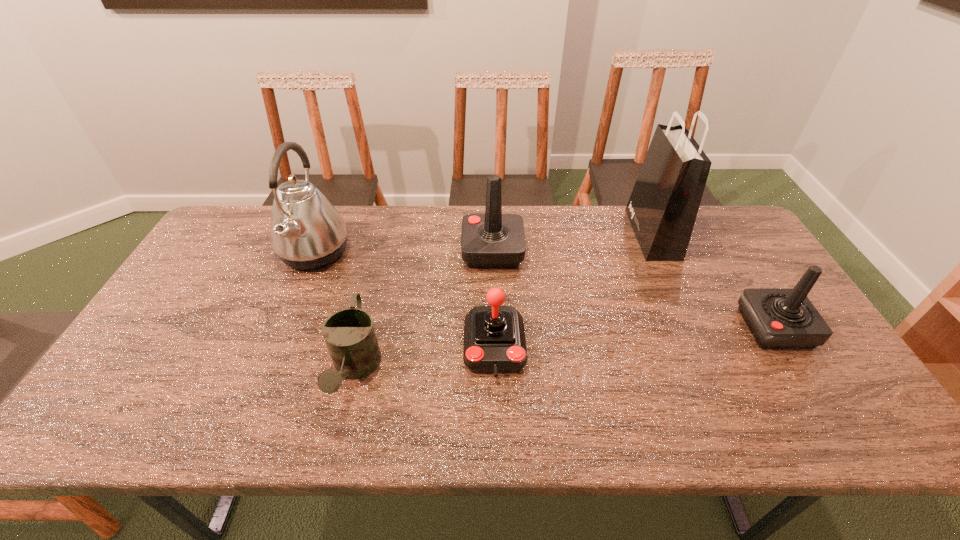
The image size is (960, 540). I want to click on the fifth object from left to right, so click(662, 209).

Identify the location of the leftmost object. (306, 231).

Locate an element on the screen. the farthest joystick is located at coordinates (493, 240).

Identify the location of the fourth shortest object. Image resolution: width=960 pixels, height=540 pixels. (493, 240).

Find the location of a particular element. the rightmost joystick is located at coordinates (779, 318).

Find the location of a particular element. the shortest joystick is located at coordinates (494, 338).

Where is `watering can`? Image resolution: width=960 pixels, height=540 pixels. watering can is located at coordinates tap(349, 334).

Find the location of a particular element. vacant region located 0.310m on the front with handles of the shopping bag is located at coordinates (540, 234).

This screenshot has width=960, height=540. What are the coordinates of `free space located 0.350m on the front with handles of the shopping bag` in the screenshot? It's located at (529, 234).

Identify the location of free region located 0.400m on the front with handles of the shopping bag. (514, 234).